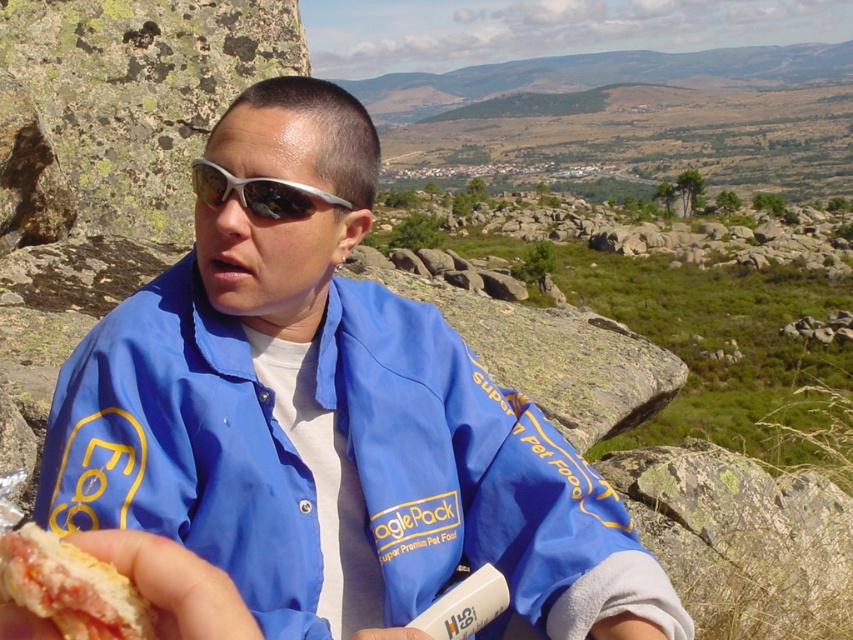
Question: Is blue fabric jacket at center further to camera compared to silver reflective sunglasses at center?

Choices:
 (A) no
 (B) yes

Answer: (A)

Question: Considering the real-world distances, which object is closest to the silver reflective sunglasses at center?

Choices:
 (A) white bread hot dog at lower left
 (B) blue fabric jacket at center

Answer: (B)

Question: Can you confirm if blue fabric jacket at center is positioned below white bread hot dog at lower left?

Choices:
 (A) no
 (B) yes

Answer: (B)

Question: From the image, what is the correct spatial relationship of blue fabric jacket at center in relation to silver reflective sunglasses at center?

Choices:
 (A) right
 (B) left

Answer: (B)

Question: Estimate the real-world distances between objects in this image. Which object is closer to the blue fabric jacket at center?

Choices:
 (A) white bread hot dog at lower left
 (B) silver reflective sunglasses at center

Answer: (B)

Question: Which point appears closest to the camera in this image?

Choices:
 (A) (328, 195)
 (B) (393, 476)
 (C) (97, 600)

Answer: (C)